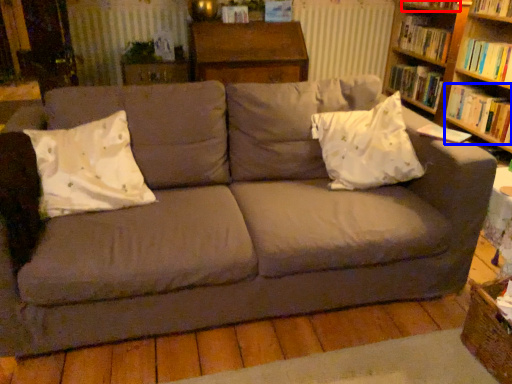
Question: Which of the following is the farthest to the observer, book (highlighted by a red box) or book (highlighted by a blue box)?

Choices:
 (A) book
 (B) book

Answer: (A)